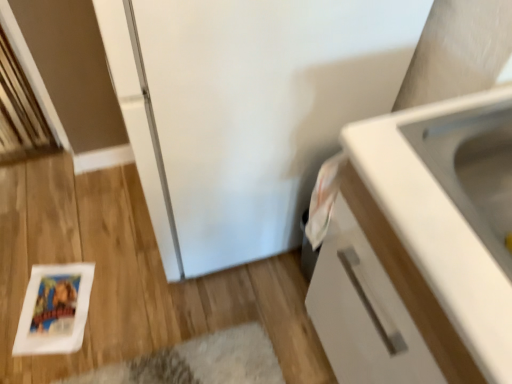
Identify the location of white matte cabinet at right. (376, 295).

Describe the element at coordinates (376, 295) in the screenshot. This screenshot has height=384, width=512. I see `white matte cabinet at right` at that location.

Image resolution: width=512 pixels, height=384 pixels. What do you see at coordinates (473, 168) in the screenshot?
I see `white glossy sink at upper right` at bounding box center [473, 168].

Identify the location of white glossy sink at upper right. (473, 168).

The height and width of the screenshot is (384, 512). In order to click on white matte cabinet at right in this screenshot , I will do `click(376, 295)`.

Which object is positioned more to the right, white glossy sink at upper right or white matte cabinet at right?

From the viewer's perspective, white matte cabinet at right appears more on the right side.

Considering the positions of objects white glossy sink at upper right and white matte cabinet at right in the image provided, who is behind, white glossy sink at upper right or white matte cabinet at right?

white glossy sink at upper right is behind.

Is point (437, 172) in front of point (334, 335)?

Yes, point (437, 172) is in front of point (334, 335).

From the image's perspective, which one is positioned higher, white glossy sink at upper right or white matte cabinet at right?

white glossy sink at upper right appears higher in the image.

Based on the photo, from a real-world perspective, which is physically below, white glossy sink at upper right or white matte cabinet at right?

white matte cabinet at right.

Considering the sizes of white glossy sink at upper right and white matte cabinet at right in the image, is white glossy sink at upper right wider or thinner than white matte cabinet at right?

Clearly, white glossy sink at upper right has less width compared to white matte cabinet at right.

Who is shorter, white glossy sink at upper right or white matte cabinet at right?

With less height is white glossy sink at upper right.

Which of these two, white glossy sink at upper right or white matte cabinet at right, is smaller?

Smaller between the two is white glossy sink at upper right.

Choose the correct answer: Is white glossy sink at upper right inside white matte cabinet at right or outside it?

white glossy sink at upper right is inside white matte cabinet at right.

Is white glossy sink at upper right with white matte cabinet at right?

No.

Could you tell me if white glossy sink at upper right is turned towards white matte cabinet at right?

Yes, white glossy sink at upper right faces towards white matte cabinet at right.

How far apart are white glossy sink at upper right and white matte cabinet at right?

white glossy sink at upper right and white matte cabinet at right are 10.17 inches apart from each other.

At what (x,y) coordinates should I click in order to perform the action: click on sink above the white matte cabinet at right (from the image's perspective). Please return your answer as a coordinate pair (x, y). Image resolution: width=512 pixels, height=384 pixels. Looking at the image, I should click on (473, 168).

Is white matte cabinet at right to the right of white glossy sink at upper right from the viewer's perspective?

Yes, white matte cabinet at right is to the right of white glossy sink at upper right.

Which object is more forward, white matte cabinet at right or white glossy sink at upper right?

white matte cabinet at right is more forward.

Which is in front, point (309, 305) or point (423, 137)?

The point (423, 137) is closer to the camera.

From the image's perspective, relative to white glossy sink at upper right, is white matte cabinet at right above or below?

white matte cabinet at right is situated lower than white glossy sink at upper right in the image.

From a real-world perspective, which is physically above, white matte cabinet at right or white glossy sink at upper right?

white glossy sink at upper right is physically above.

Considering the sizes of objects white matte cabinet at right and white glossy sink at upper right in the image provided, who is thinner, white matte cabinet at right or white glossy sink at upper right?

With smaller width is white glossy sink at upper right.

Is white matte cabinet at right shorter than white glossy sink at upper right?

In fact, white matte cabinet at right may be taller than white glossy sink at upper right.

Considering the sizes of white matte cabinet at right and white glossy sink at upper right in the image, is white matte cabinet at right bigger or smaller than white glossy sink at upper right?

Clearly, white matte cabinet at right is larger in size than white glossy sink at upper right.

Is white glossy sink at upper right surrounded by white matte cabinet at right?

Indeed, white glossy sink at upper right is located within white matte cabinet at right.

Is white matte cabinet at right placed right next to white glossy sink at upper right?

white matte cabinet at right and white glossy sink at upper right are clearly separated.

Is white matte cabinet at right aimed at white glossy sink at upper right?

No, white matte cabinet at right is not aimed at white glossy sink at upper right.

What's the angular difference between white matte cabinet at right and white glossy sink at upper right's facing directions?

The angle between the facing direction of white matte cabinet at right and the facing direction of white glossy sink at upper right is 1.18 degrees.

Identify the location of sink lying above the white matte cabinet at right (from the image's perspective). (473, 168).

Locate an element on the screen. The width and height of the screenshot is (512, 384). cabinetry that is below the white glossy sink at upper right (from the image's perspective) is located at coordinates (376, 295).

I want to click on cabinetry in front of the white glossy sink at upper right, so click(376, 295).